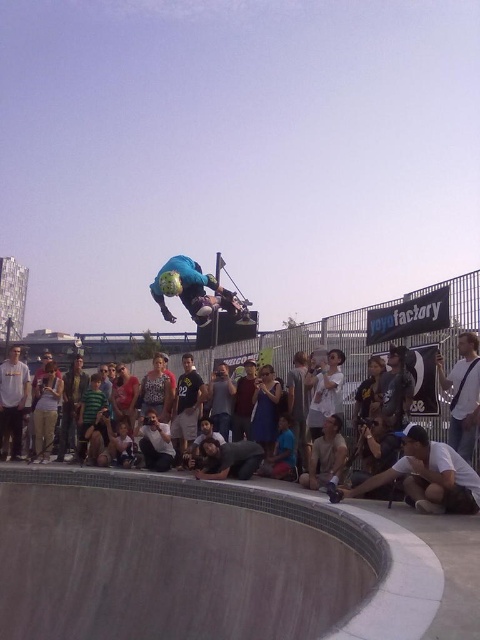
Is smooth concrete bowl at center to the right of white cotton shirt at center from the viewer's perspective?

No, smooth concrete bowl at center is not to the right of white cotton shirt at center.

Is smooth concrete bowl at center taller than white cotton shirt at center?

Yes, smooth concrete bowl at center is taller than white cotton shirt at center.

From the picture: Who is more distant from viewer, (330, 577) or (335, 355)?

Point (335, 355)

Locate an element on the screen. This screenshot has width=480, height=640. smooth concrete bowl at center is located at coordinates (175, 557).

Can you confirm if white cotton shirt at center is wider than denim jacket at lower left?

Yes, white cotton shirt at center is wider than denim jacket at lower left.

Who is higher up, white cotton shirt at center or denim jacket at lower left?

Positioned higher is white cotton shirt at center.

Is point (309, 424) closer to camera compared to point (49, 410)?

That is True.

Locate an element on the screen. Image resolution: width=480 pixels, height=640 pixels. white cotton shirt at center is located at coordinates tap(324, 392).

Does denim jacket at lower left have a greater height compared to blue fabric shirt at center?

No.

Does denim jacket at lower left have a lesser height compared to blue fabric shirt at center?

Yes.

Find the location of a particular element. This screenshot has height=640, width=480. denim jacket at lower left is located at coordinates (46, 412).